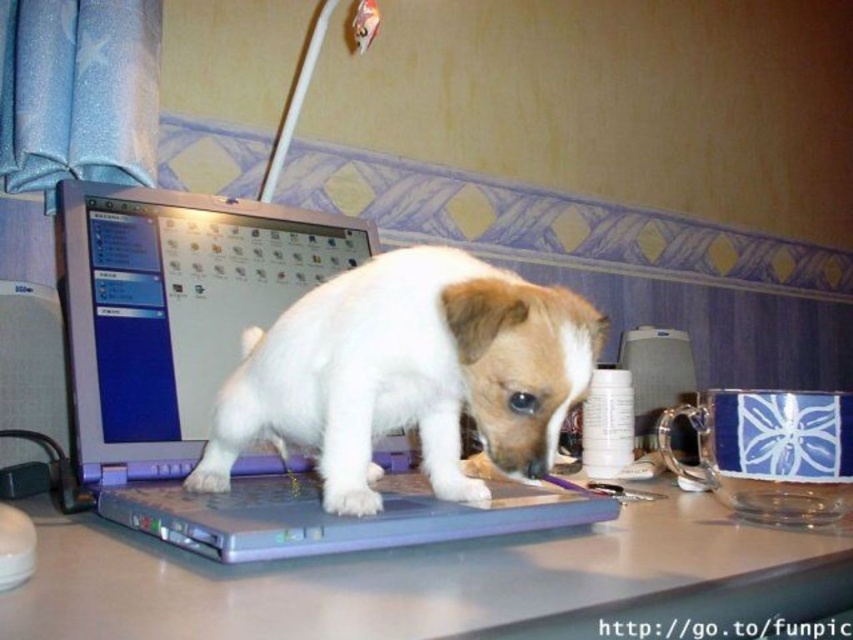
Is white fur dog at center to the left of satin silver laptop at center from the viewer's perspective?

No, white fur dog at center is not to the left of satin silver laptop at center.

What do you see at coordinates (408, 374) in the screenshot? I see `white fur dog at center` at bounding box center [408, 374].

The width and height of the screenshot is (853, 640). Identify the location of white fur dog at center. (408, 374).

Between point (70, 604) and point (171, 227), which one is positioned in front?

Point (70, 604) is more forward.

Find the location of `gray plastic laptop at center`. gray plastic laptop at center is located at coordinates (434, 580).

What are the coordinates of `gray plastic laptop at center` in the screenshot? It's located at (434, 580).

Is gray plastic laptop at center closer to the viewer compared to white fur dog at center?

Yes, gray plastic laptop at center is closer to the viewer.

Measure the distance between gray plastic laptop at center and white fur dog at center.

6.05 inches

Where is `gray plastic laptop at center`? This screenshot has width=853, height=640. gray plastic laptop at center is located at coordinates (434, 580).

Locate an element on the screen. The width and height of the screenshot is (853, 640). gray plastic laptop at center is located at coordinates (434, 580).